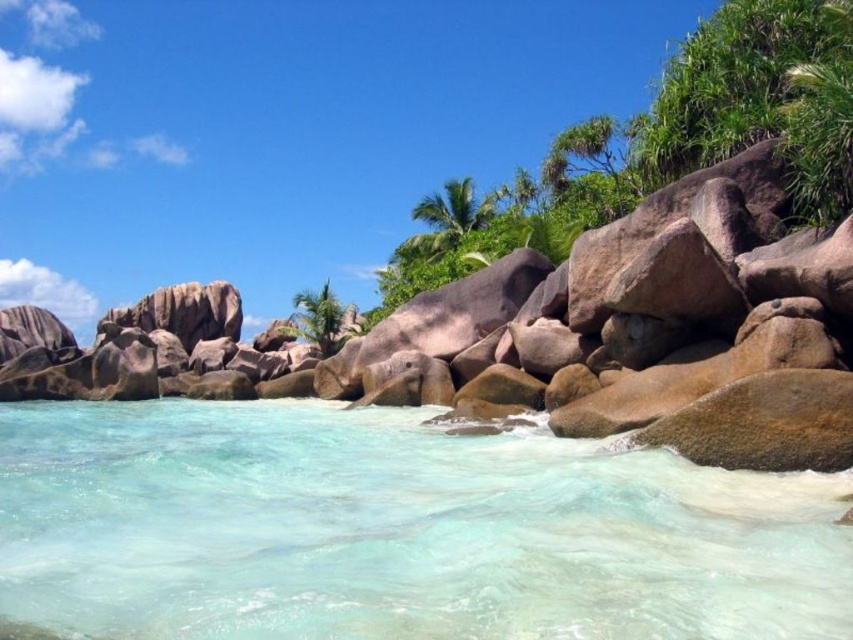
In the scene shown: You are standing at the origin point of the image coordinate system. You want to walk to the clear water at lower center. According to the coordinate system, which direction should you move? Please answer with the direction in terms of x and y axes. For example, move in the positive x direction and negative y direction.

The clear water at lower center is located at coordinate point (397, 531). Since the origin is at the bottom left corner of the image, moving towards the positive x direction means moving to the right, and the positive y direction means moving upwards. To reach the clear water at lower center, you should move in the positive x direction and positive y direction from the origin.

You are standing on the beach and want to take a photo of the clear water at lower center. Where should you position yourself to capture it in the lower center of your camera frame?

To capture the clear water at lower center in the lower center of your camera frame, position yourself directly in front of it, aligning the camera lens with the coordinates provided at point (397, 531).